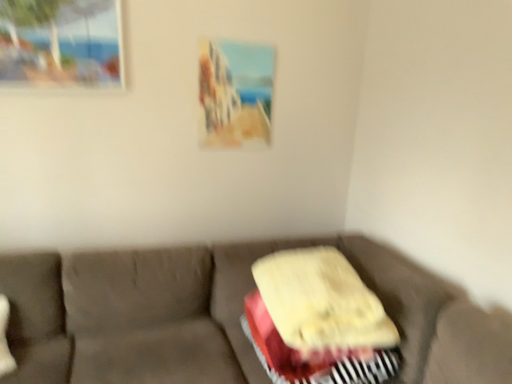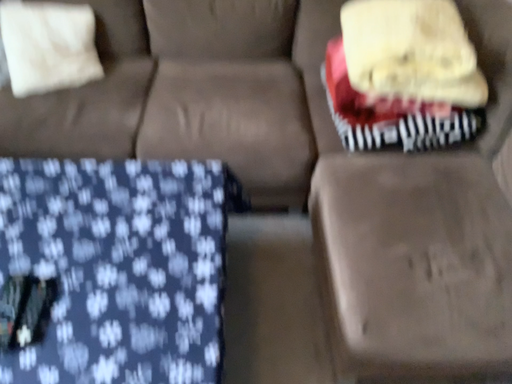
Question: Which way did the camera rotate in the video?

Choices:
 (A) rotated left
 (B) rotated right

Answer: (A)